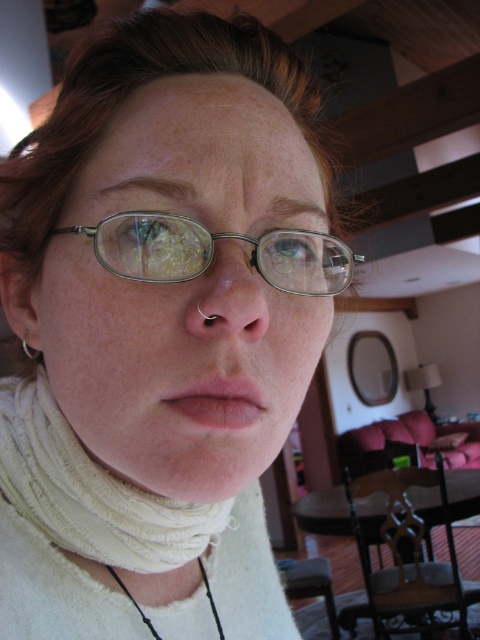
Question: Which object is closer to the camera taking this photo?

Choices:
 (A) metallic silver glasses at center
 (B) matte silver glasses at center
 (C) pink matte lips at center

Answer: (B)

Question: In this image, where is metallic silver glasses at center located relative to pink matte lips at center?

Choices:
 (A) below
 (B) above

Answer: (B)

Question: Which of the following is the farthest from the observer?

Choices:
 (A) white ribbed turtleneck at center
 (B) metallic silver glasses at center
 (C) pink matte lips at center

Answer: (A)

Question: Among these objects, which one is nearest to the camera?

Choices:
 (A) matte silver glasses at center
 (B) pink matte lips at center
 (C) metallic silver glasses at center
 (D) white ribbed turtleneck at center

Answer: (A)

Question: Is white ribbed turtleneck at center further to camera compared to metallic silver glasses at center?

Choices:
 (A) no
 (B) yes

Answer: (B)

Question: Is matte silver glasses at center in front of pink matte lips at center?

Choices:
 (A) yes
 (B) no

Answer: (A)